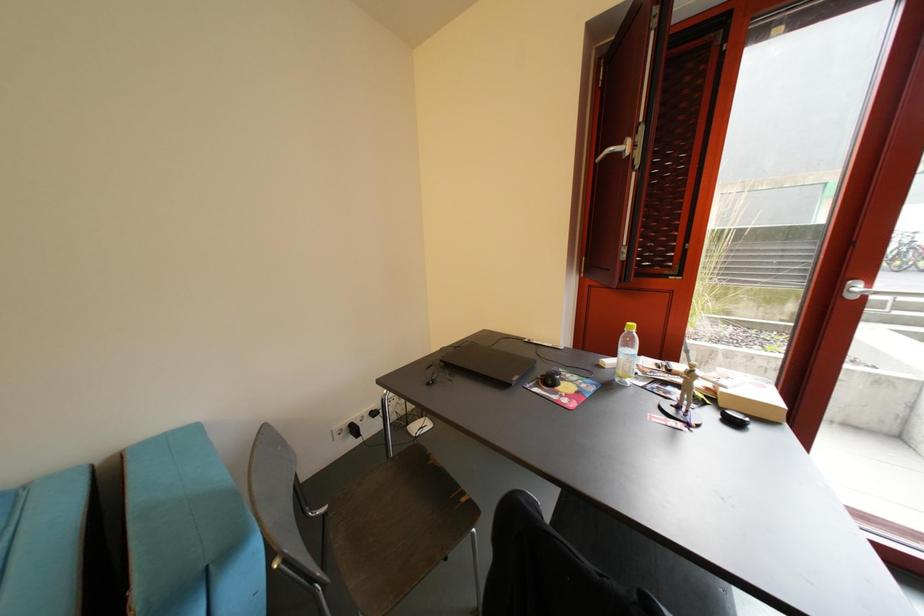
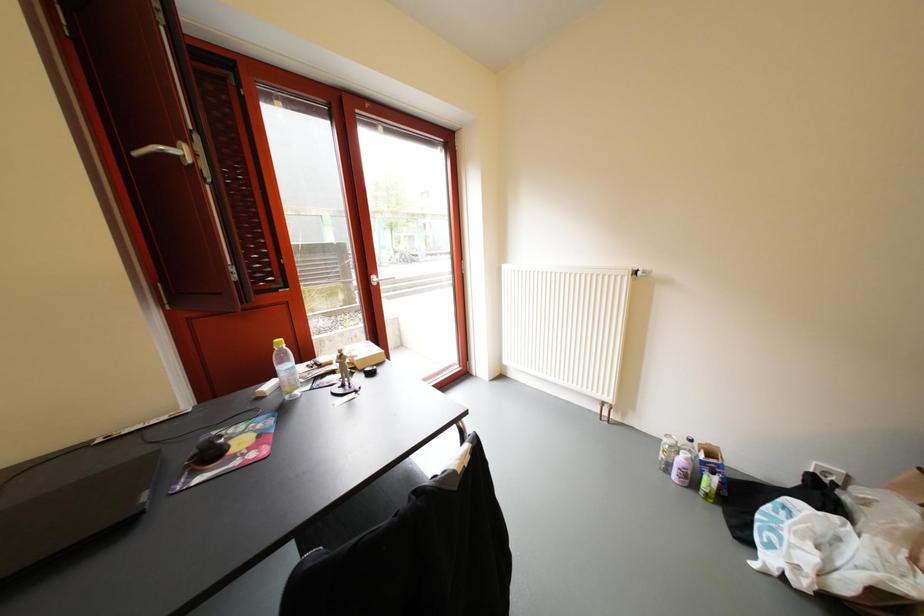
Question: The images are taken continuously from a first-person perspective. In which direction is your viewpoint rotating?

Choices:
 (A) Left
 (B) Right
 (C) Up
 (D) Down

Answer: (B)